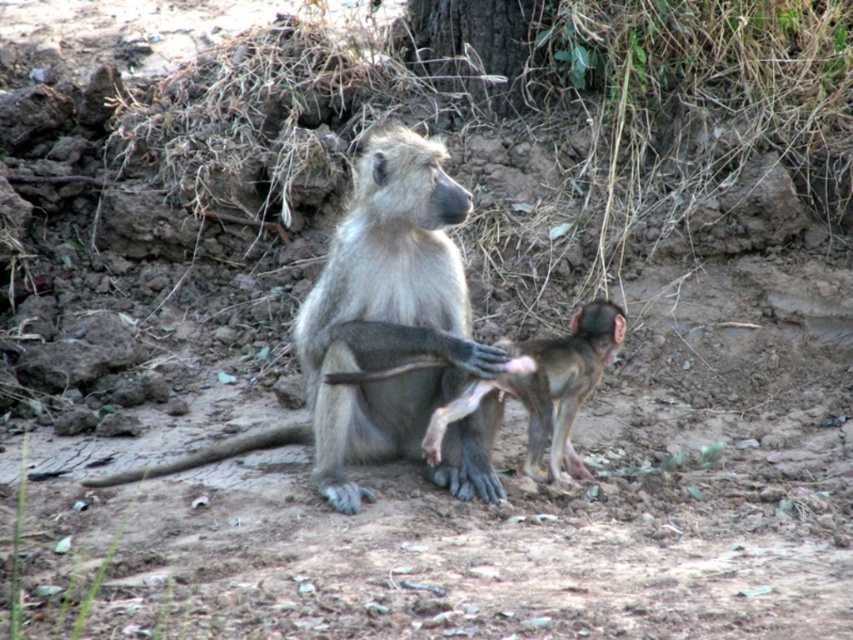
You are a wildlife researcher observing two monkeys in the center of the image. The gray fur monkey at center and the smooth brown monkey at center. Based on their sizes, which one is likely the adult?

The gray fur monkey at center is likely the adult since it has a greater height compared to the smooth brown monkey at center.